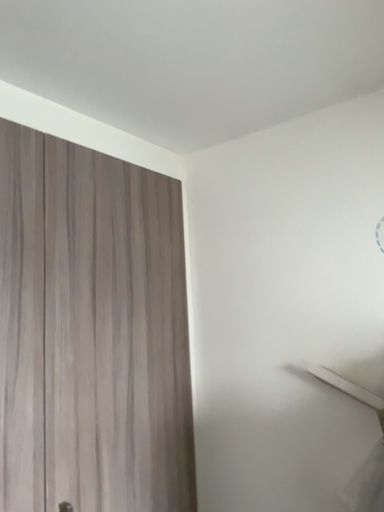
This screenshot has width=384, height=512. I want to click on wooden curtain at left, so click(x=91, y=332).

This screenshot has height=512, width=384. What do you see at coordinates (91, 332) in the screenshot?
I see `wooden curtain at left` at bounding box center [91, 332].

What is the approximate width of wooden curtain at left?

2.47 inches.

Locate an element on the screen. The width and height of the screenshot is (384, 512). wooden curtain at left is located at coordinates (91, 332).